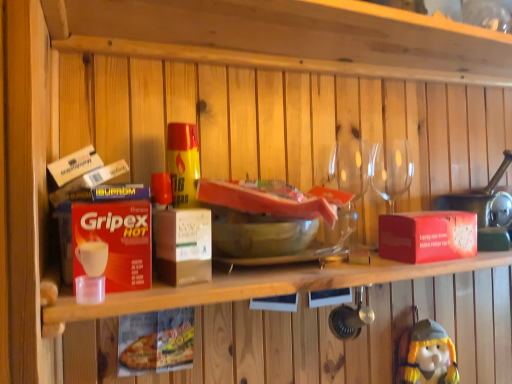
Question: Does yellow plush toy at lower right have a lesser width compared to red matte box at right, which is the second box in left-to-right order?

Choices:
 (A) no
 (B) yes

Answer: (B)

Question: From the image's perspective, is yellow plush toy at lower right located above red matte box at right, which is the second box in left-to-right order?

Choices:
 (A) no
 (B) yes

Answer: (A)

Question: Is yellow plush toy at lower right positioned beyond the bounds of red matte box at right, the 2th box from the front?

Choices:
 (A) yes
 (B) no

Answer: (A)

Question: Considering the relative sizes of yellow plush toy at lower right and red matte box at right, positioned as the first box in back-to-front order, in the image provided, is yellow plush toy at lower right smaller than red matte box at right, positioned as the first box in back-to-front order,?

Choices:
 (A) yes
 (B) no

Answer: (B)

Question: Does yellow plush toy at lower right have a greater width compared to red matte box at right, which is the second box in left-to-right order?

Choices:
 (A) yes
 (B) no

Answer: (B)

Question: From a real-world perspective, is transparent glass wine glasses at upper right physically located above or below red matte box at right, which is the second box in left-to-right order?

Choices:
 (A) below
 (B) above

Answer: (B)

Question: From the image's perspective, is transparent glass wine glasses at upper right above or below red matte box at right, positioned as the first box in back-to-front order?

Choices:
 (A) below
 (B) above

Answer: (B)

Question: In terms of width, does transparent glass wine glasses at upper right look wider or thinner when compared to red matte box at right, which is the second box in left-to-right order?

Choices:
 (A) thin
 (B) wide

Answer: (A)

Question: Is point (396, 163) closer or farther from the camera than point (394, 249)?

Choices:
 (A) closer
 (B) farther

Answer: (B)

Question: Is point (395, 258) closer or farther from the camera than point (398, 190)?

Choices:
 (A) closer
 (B) farther

Answer: (A)

Question: Considering the positions of red matte box at right, positioned as the first box in back-to-front order, and transparent glass wine glasses at upper right in the image, is red matte box at right, positioned as the first box in back-to-front order, taller or shorter than transparent glass wine glasses at upper right?

Choices:
 (A) tall
 (B) short

Answer: (B)

Question: In the image, is red matte box at right, which is the second box in left-to-right order, on the left side or the right side of transparent glass wine glasses at upper right?

Choices:
 (A) right
 (B) left

Answer: (A)

Question: Considering their positions, is red matte box at right, the 2th box from the front, located in front of or behind transparent glass wine glasses at upper right?

Choices:
 (A) behind
 (B) front

Answer: (B)

Question: Considering their positions, is red cardboard box at upper center, the second shelf positioned from the top, located in front of or behind transparent glass wine glasses at upper right?

Choices:
 (A) front
 (B) behind

Answer: (A)

Question: In terms of size, does red cardboard box at upper center, the second shelf positioned from the top, appear bigger or smaller than transparent glass wine glasses at upper right?

Choices:
 (A) small
 (B) big

Answer: (B)